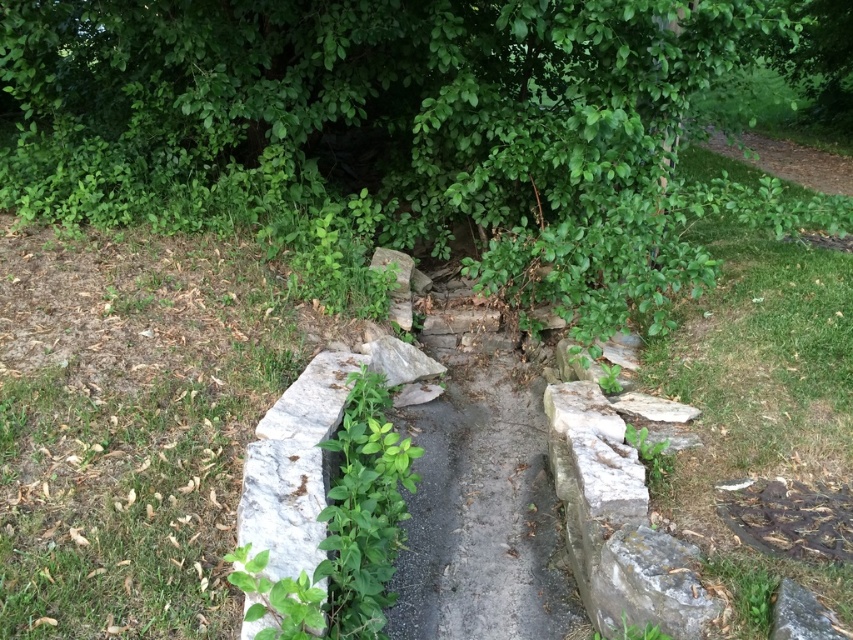
You are standing at the entrance of the pathway and notice both the gray stone path at center and the green leafy weed at center. Which object is positioned to the left?

The green leafy weed at center is positioned to the left of the gray stone path at center.

You are a hiker walking along the narrow pathway bordered by stone walls. You notice a green leafy tree at upper center and a green leafy weed at center. Which one is closer to you as you walk along the path?

The green leafy weed at center is closer to you because the green leafy tree at upper center is further away from the viewer.

You are standing at the entrance of the pathway and looking towards the green leafy tree at upper center and the green leafy weed at center. Which object is higher up in your field of view?

The green leafy tree at upper center is located above the green leafy weed at center, so it is higher up in your field of view.